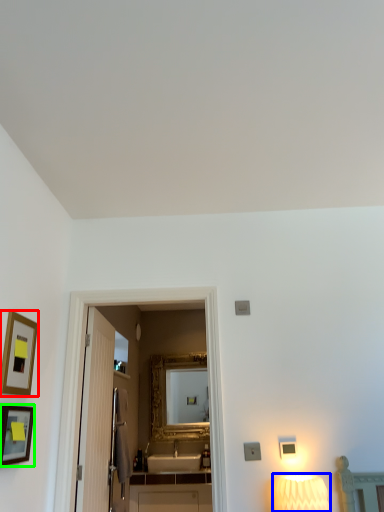
Question: Based on their relative distances, which object is farther from picture frame (highlighted by a red box)? Choose from lamp (highlighted by a blue box) and picture frame (highlighted by a green box).

Choices:
 (A) lamp
 (B) picture frame

Answer: (A)